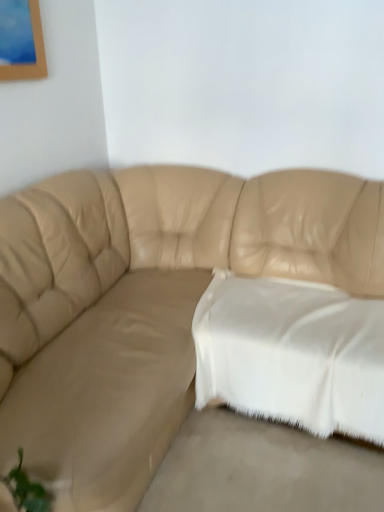
Question: Is the position of beige leather couch at center more distant than that of white soft fabric pillow at center?

Choices:
 (A) yes
 (B) no

Answer: (B)

Question: Could you tell me if beige leather couch at center is turned towards white soft fabric pillow at center?

Choices:
 (A) no
 (B) yes

Answer: (A)

Question: Is beige leather couch at center to the left of white soft fabric pillow at center from the viewer's perspective?

Choices:
 (A) yes
 (B) no

Answer: (A)

Question: Does beige leather couch at center have a greater width compared to white soft fabric pillow at center?

Choices:
 (A) yes
 (B) no

Answer: (A)

Question: Can you see beige leather couch at center touching white soft fabric pillow at center?

Choices:
 (A) yes
 (B) no

Answer: (B)

Question: From the image's perspective, is beige leather couch at center located beneath white soft fabric pillow at center?

Choices:
 (A) yes
 (B) no

Answer: (B)

Question: Is white soft fabric pillow at center oriented towards beige leather couch at lower left?

Choices:
 (A) yes
 (B) no

Answer: (B)

Question: Can you confirm if white soft fabric pillow at center is bigger than beige leather couch at lower left?

Choices:
 (A) no
 (B) yes

Answer: (B)

Question: Is white soft fabric pillow at center at the left side of beige leather couch at lower left?

Choices:
 (A) yes
 (B) no

Answer: (B)

Question: Is white soft fabric pillow at center wider than beige leather couch at lower left?

Choices:
 (A) no
 (B) yes

Answer: (B)

Question: Is white soft fabric pillow at center placed right next to beige leather couch at lower left?

Choices:
 (A) yes
 (B) no

Answer: (B)

Question: Is white soft fabric pillow at center smaller than beige leather couch at lower left?

Choices:
 (A) yes
 (B) no

Answer: (B)

Question: Is beige leather couch at lower left taller than beige leather couch at center?

Choices:
 (A) no
 (B) yes

Answer: (A)